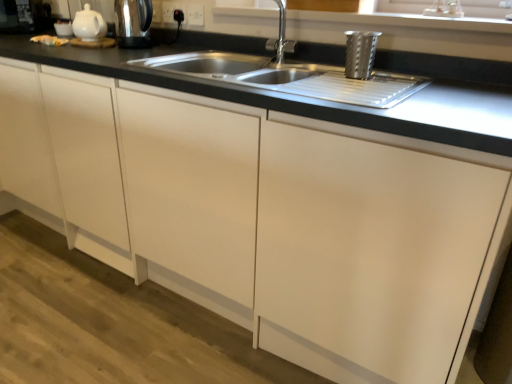
I want to click on free space in front of metallic stainless steel kettle at upper left, the second appliance in the bottom-to-top sequence, so click(x=125, y=57).